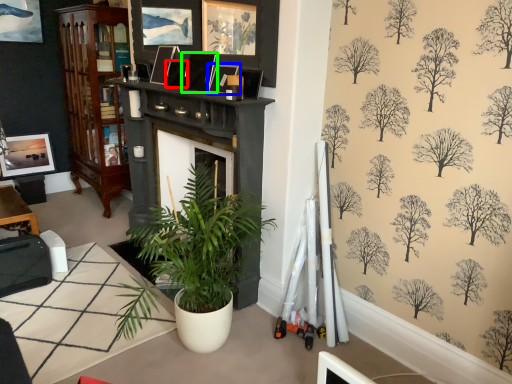
Question: Considering the real-world distances, which object is closest to picture frame (highlighted by a red box)? picture frame (highlighted by a blue box) or picture frame (highlighted by a green box).

Choices:
 (A) picture frame
 (B) picture frame

Answer: (B)